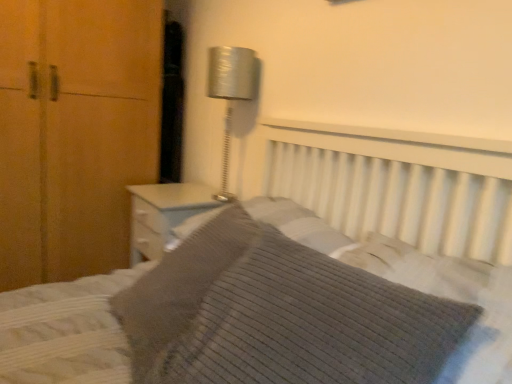
Describe the element at coordinates (314, 324) in the screenshot. This screenshot has width=512, height=384. I see `ribbed gray pillow at center, placed as the 2th pillow when sorted from back to front` at that location.

Consider the image. Measure the distance between knitted fabric bed at center and camera.

The depth of knitted fabric bed at center is 62.26 centimeters.

The width and height of the screenshot is (512, 384). What do you see at coordinates (230, 94) in the screenshot?
I see `metallic silver lamp at upper center` at bounding box center [230, 94].

What is the approximate height of knitted gray pillow at center, marked as the 1th pillow in a back-to-front arrangement?

knitted gray pillow at center, marked as the 1th pillow in a back-to-front arrangement, is 12.19 inches tall.

In order to face knitted gray pillow at center, the 2th pillow when ordered from front to back, should I rotate leftwards or rightwards?

To face it directly, rotate left by 7.603 degrees.

The image size is (512, 384). What are the coordinates of `ribbed gray pillow at center, acting as the 1th pillow starting from the front` in the screenshot? It's located at (314, 324).

Between point (283, 248) and point (253, 70), which one is positioned behind?

The point (253, 70) is farther.

Considering the positions of objects ribbed gray pillow at center, acting as the 1th pillow starting from the front, and metallic silver lamp at upper center in the image provided, who is more to the left, ribbed gray pillow at center, acting as the 1th pillow starting from the front, or metallic silver lamp at upper center?

From the viewer's perspective, metallic silver lamp at upper center appears more on the left side.

From the image's perspective, who appears lower, ribbed gray pillow at center, acting as the 1th pillow starting from the front, or metallic silver lamp at upper center?

ribbed gray pillow at center, acting as the 1th pillow starting from the front.

Considering the sizes of objects ribbed gray pillow at center, placed as the 2th pillow when sorted from back to front, and metallic silver lamp at upper center in the image provided, who is bigger, ribbed gray pillow at center, placed as the 2th pillow when sorted from back to front, or metallic silver lamp at upper center?

With larger size is ribbed gray pillow at center, placed as the 2th pillow when sorted from back to front.

Between metallic silver lamp at upper center and knitted fabric bed at center, which one is positioned behind?

Positioned behind is metallic silver lamp at upper center.

Choose the correct answer: Is metallic silver lamp at upper center inside knitted fabric bed at center or outside it?

metallic silver lamp at upper center cannot be found inside knitted fabric bed at center.

From the image's perspective, between metallic silver lamp at upper center and knitted fabric bed at center, which one is located above?

metallic silver lamp at upper center appears higher in the image.

Image resolution: width=512 pixels, height=384 pixels. Identify the location of bed below the metallic silver lamp at upper center (from a real-world perspective). (297, 283).

Is point (200, 246) more distant than point (154, 341)?

Yes, it is.

Could you tell me if knitted fabric bed at center is facing knitted gray pillow at center, marked as the 1th pillow in a back-to-front arrangement?

Yes.

Is knitted fabric bed at center inside or outside of knitted gray pillow at center, marked as the 1th pillow in a back-to-front arrangement?

knitted fabric bed at center lies outside knitted gray pillow at center, marked as the 1th pillow in a back-to-front arrangement.

Is knitted fabric bed at center far from knitted gray pillow at center, the 2th pillow when ordered from front to back?

knitted fabric bed at center is near knitted gray pillow at center, the 2th pillow when ordered from front to back, not far away.

Based on the photo, relative to knitted gray pillow at center, the 2th pillow when ordered from front to back, is metallic silver lamp at upper center in front or behind?

In the image, metallic silver lamp at upper center appears behind knitted gray pillow at center, the 2th pillow when ordered from front to back.

Is metallic silver lamp at upper center surrounding knitted gray pillow at center, marked as the 1th pillow in a back-to-front arrangement?

No, knitted gray pillow at center, marked as the 1th pillow in a back-to-front arrangement, is located outside of metallic silver lamp at upper center.

The width and height of the screenshot is (512, 384). In order to click on bedside lamp behind the knitted gray pillow at center, the 2th pillow when ordered from front to back in this screenshot , I will do `click(230, 94)`.

From the image's perspective, relative to knitted gray pillow at center, marked as the 1th pillow in a back-to-front arrangement, is metallic silver lamp at upper center above or below?

Based on their image positions, metallic silver lamp at upper center is located above knitted gray pillow at center, marked as the 1th pillow in a back-to-front arrangement.

Considering the sizes of objects ribbed gray pillow at center, placed as the 2th pillow when sorted from back to front, and knitted fabric bed at center in the image provided, who is shorter, ribbed gray pillow at center, placed as the 2th pillow when sorted from back to front, or knitted fabric bed at center?

ribbed gray pillow at center, placed as the 2th pillow when sorted from back to front.

Is ribbed gray pillow at center, placed as the 2th pillow when sorted from back to front, to the right of knitted fabric bed at center from the viewer's perspective?

Yes, ribbed gray pillow at center, placed as the 2th pillow when sorted from back to front, is to the right of knitted fabric bed at center.

Is ribbed gray pillow at center, acting as the 1th pillow starting from the front, beside knitted fabric bed at center?

No, ribbed gray pillow at center, acting as the 1th pillow starting from the front, is not beside knitted fabric bed at center.

Looking at their sizes, would you say ribbed gray pillow at center, placed as the 2th pillow when sorted from back to front, is wider or thinner than knitted fabric bed at center?

ribbed gray pillow at center, placed as the 2th pillow when sorted from back to front, is thinner than knitted fabric bed at center.

Would you consider knitted gray pillow at center, the 2th pillow when ordered from front to back, to be distant from knitted fabric bed at center?

Actually, knitted gray pillow at center, the 2th pillow when ordered from front to back, and knitted fabric bed at center are a little close together.

From the image's perspective, would you say knitted gray pillow at center, the 2th pillow when ordered from front to back, is shown under knitted fabric bed at center?

Incorrect, from the image's perspective, knitted gray pillow at center, the 2th pillow when ordered from front to back, is higher than knitted fabric bed at center.

From a real-world perspective, is knitted gray pillow at center, the 2th pillow when ordered from front to back, located higher than knitted fabric bed at center?

Yes, from a real-world perspective, knitted gray pillow at center, the 2th pillow when ordered from front to back, is above knitted fabric bed at center.

Considering the sizes of objects knitted gray pillow at center, the 2th pillow when ordered from front to back, and knitted fabric bed at center in the image provided, who is shorter, knitted gray pillow at center, the 2th pillow when ordered from front to back, or knitted fabric bed at center?

knitted gray pillow at center, the 2th pillow when ordered from front to back, is shorter.

Can you tell me how much metallic silver lamp at upper center and ribbed gray pillow at center, placed as the 2th pillow when sorted from back to front, differ in facing direction?

There is a 11.1-degree angle between the facing directions of metallic silver lamp at upper center and ribbed gray pillow at center, placed as the 2th pillow when sorted from back to front.

Can you confirm if metallic silver lamp at upper center is positioned to the left of ribbed gray pillow at center, placed as the 2th pillow when sorted from back to front?

Indeed, metallic silver lamp at upper center is positioned on the left side of ribbed gray pillow at center, placed as the 2th pillow when sorted from back to front.

Is metallic silver lamp at upper center in front of or behind ribbed gray pillow at center, acting as the 1th pillow starting from the front, in the image?

Clearly, metallic silver lamp at upper center is behind ribbed gray pillow at center, acting as the 1th pillow starting from the front.

The height and width of the screenshot is (384, 512). Find the location of `bedside lamp located on the left of ribbed gray pillow at center, placed as the 2th pillow when sorted from back to front`. bedside lamp located on the left of ribbed gray pillow at center, placed as the 2th pillow when sorted from back to front is located at coordinates (230, 94).

I want to click on bed in front of the metallic silver lamp at upper center, so click(297, 283).

Estimate the real-world distances between objects in this image. Which object is closer to knitted fabric bed at center, metallic silver lamp at upper center or ribbed gray pillow at center, acting as the 1th pillow starting from the front?

Based on the image, ribbed gray pillow at center, acting as the 1th pillow starting from the front, appears to be nearer to knitted fabric bed at center.

When comparing their distances from knitted fabric bed at center, does knitted gray pillow at center, marked as the 1th pillow in a back-to-front arrangement, or metallic silver lamp at upper center seem further?

metallic silver lamp at upper center lies further to knitted fabric bed at center than the other object.

Looking at the image, which one is located further to knitted gray pillow at center, marked as the 1th pillow in a back-to-front arrangement, metallic silver lamp at upper center or ribbed gray pillow at center, placed as the 2th pillow when sorted from back to front?

Based on the image, metallic silver lamp at upper center appears to be further to knitted gray pillow at center, marked as the 1th pillow in a back-to-front arrangement.

Considering their positions, is knitted fabric bed at center positioned closer to ribbed gray pillow at center, placed as the 2th pillow when sorted from back to front, than knitted gray pillow at center, the 2th pillow when ordered from front to back?

knitted fabric bed at center is closer to ribbed gray pillow at center, placed as the 2th pillow when sorted from back to front.

Looking at the image, which one is located closer to metallic silver lamp at upper center, knitted fabric bed at center or knitted gray pillow at center, marked as the 1th pillow in a back-to-front arrangement?

knitted fabric bed at center lies closer to metallic silver lamp at upper center than the other object.

Looking at the image, which one is located further to ribbed gray pillow at center, placed as the 2th pillow when sorted from back to front, knitted fabric bed at center or metallic silver lamp at upper center?

metallic silver lamp at upper center is further to ribbed gray pillow at center, placed as the 2th pillow when sorted from back to front.

Considering their positions, is knitted gray pillow at center, the 2th pillow when ordered from front to back, positioned closer to ribbed gray pillow at center, acting as the 1th pillow starting from the front, than knitted fabric bed at center?

Among the two, knitted fabric bed at center is located nearer to ribbed gray pillow at center, acting as the 1th pillow starting from the front.

Estimate the real-world distances between objects in this image. Which object is closer to metallic silver lamp at upper center, ribbed gray pillow at center, placed as the 2th pillow when sorted from back to front, or knitted fabric bed at center?

knitted fabric bed at center.

Where is `pillow located between knitted fabric bed at center and knitted gray pillow at center, marked as the 1th pillow in a back-to-front arrangement, in the depth direction`? pillow located between knitted fabric bed at center and knitted gray pillow at center, marked as the 1th pillow in a back-to-front arrangement, in the depth direction is located at coordinates (314, 324).

Find the location of a particular element. This screenshot has width=512, height=384. pillow located between ribbed gray pillow at center, acting as the 1th pillow starting from the front, and metallic silver lamp at upper center in the depth direction is located at coordinates (179, 286).